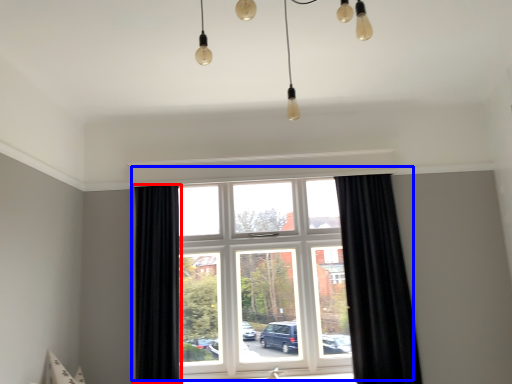
Question: Which point is closer to the camera, curtain (highlighted by a red box) or window (highlighted by a blue box)?

Choices:
 (A) curtain
 (B) window

Answer: (A)